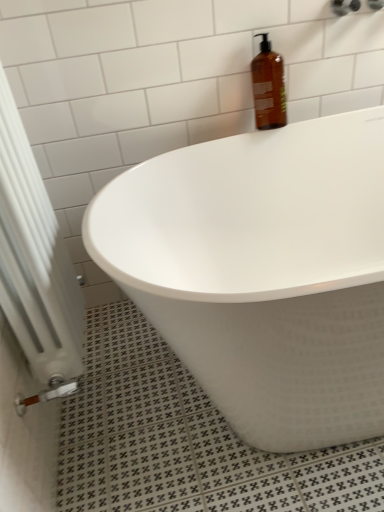
What is the approximate width of white glossy bathtub at upper center?

white glossy bathtub at upper center is 28.47 inches in width.

You are a GUI agent. You are given a task and a screenshot of the screen. Output one action in this format:
    pyautogui.click(x=<x>, y=<y>)
    Task: Click on the white glossy bathtub at upper center
    
    Given the screenshot: What is the action you would take?
    pyautogui.click(x=263, y=273)

The height and width of the screenshot is (512, 384). In order to click on radiator that appears on the left of brown glass bottle at upper center in this screenshot , I will do `click(35, 259)`.

Is brown glass bottle at upper center at the right side of white metallic radiator at lower left?

Correct, you'll find brown glass bottle at upper center to the right of white metallic radiator at lower left.

Looking at this image, is brown glass bottle at upper center beside white metallic radiator at lower left?

No, brown glass bottle at upper center is not touching white metallic radiator at lower left.

Based on the photo, is brown glass bottle at upper center looking in the opposite direction of white metallic radiator at lower left?

brown glass bottle at upper center is not turned away from white metallic radiator at lower left.

From a real-world perspective, does white metallic radiator at lower left sit lower than brown glass bottle at upper center?

Yes, from a real-world perspective, white metallic radiator at lower left is beneath brown glass bottle at upper center.

Is white metallic radiator at lower left at the right side of brown glass bottle at upper center?

No, white metallic radiator at lower left is not to the right of brown glass bottle at upper center.

Is brown glass bottle at upper center at the back of white glossy bathtub at upper center?

No.

From the image's perspective, is white glossy bathtub at upper center located above or below brown glass bottle at upper center?

Based on their image positions, white glossy bathtub at upper center is located beneath brown glass bottle at upper center.

How many degrees apart are the facing directions of white glossy bathtub at upper center and brown glass bottle at upper center?

The angular difference between white glossy bathtub at upper center and brown glass bottle at upper center is 0.916 degrees.

The width and height of the screenshot is (384, 512). What are the coordinates of `bathtub located below the brown glass bottle at upper center (from the image's perspective)` in the screenshot? It's located at (263, 273).

Which is correct: white glossy bathtub at upper center is inside white metallic radiator at lower left, or outside of it?

white glossy bathtub at upper center is not enclosed by white metallic radiator at lower left.

In terms of width, does white glossy bathtub at upper center look wider or thinner when compared to white metallic radiator at lower left?

Clearly, white glossy bathtub at upper center has more width compared to white metallic radiator at lower left.

Locate an element on the screen. Image resolution: width=384 pixels, height=512 pixels. bathtub on the right side of white metallic radiator at lower left is located at coordinates (263, 273).

In the scene shown: Visually, is white glossy bathtub at upper center positioned to the left or to the right of white metallic radiator at lower left?

white glossy bathtub at upper center is positioned on white metallic radiator at lower left's right side.

From a real-world perspective, is brown glass bottle at upper center above or below white glossy bathtub at upper center?

brown glass bottle at upper center is above white glossy bathtub at upper center.

Is brown glass bottle at upper center smaller than white glossy bathtub at upper center?

Yes, brown glass bottle at upper center is smaller than white glossy bathtub at upper center.

Is brown glass bottle at upper center at the left side of white glossy bathtub at upper center?

Correct, you'll find brown glass bottle at upper center to the left of white glossy bathtub at upper center.

You are a GUI agent. You are given a task and a screenshot of the screen. Output one action in this format:
    pyautogui.click(x=<x>, y=<y>)
    Task: Click on the bathtub that is in front of the brown glass bottle at upper center
    
    Given the screenshot: What is the action you would take?
    pyautogui.click(x=263, y=273)

Could you tell me if white metallic radiator at lower left is facing white glossy bathtub at upper center?

Yes, white metallic radiator at lower left is aimed at white glossy bathtub at upper center.

Is point (2, 112) farther from camera compared to point (115, 192)?

No, (2, 112) is in front of (115, 192).

From the image's perspective, is white metallic radiator at lower left above or below white glossy bathtub at upper center?

white metallic radiator at lower left is situated higher than white glossy bathtub at upper center in the image.

From the picture: Considering their positions, is white metallic radiator at lower left located in front of or behind white glossy bathtub at upper center?

white metallic radiator at lower left is positioned closer to the viewer than white glossy bathtub at upper center.

Identify the location of radiator below the brown glass bottle at upper center (from a real-world perspective). This screenshot has width=384, height=512. (35, 259).

Locate an element on the screen. This screenshot has width=384, height=512. radiator below the brown glass bottle at upper center (from the image's perspective) is located at coordinates (35, 259).

Estimate the real-world distances between objects in this image. Which object is further from white metallic radiator at lower left, brown glass bottle at upper center or white glossy bathtub at upper center?

The object further to white metallic radiator at lower left is brown glass bottle at upper center.

From the image, which object appears to be nearer to brown glass bottle at upper center, white metallic radiator at lower left or white glossy bathtub at upper center?

The object closer to brown glass bottle at upper center is white glossy bathtub at upper center.

Looking at the image, which one is located closer to white glossy bathtub at upper center, white metallic radiator at lower left or brown glass bottle at upper center?

white metallic radiator at lower left is closer to white glossy bathtub at upper center.

Considering their positions, is white glossy bathtub at upper center positioned further to white metallic radiator at lower left than brown glass bottle at upper center?

Based on the image, brown glass bottle at upper center appears to be further to white metallic radiator at lower left.

When comparing their distances from brown glass bottle at upper center, does white glossy bathtub at upper center or white metallic radiator at lower left seem further?

Based on the image, white metallic radiator at lower left appears to be further to brown glass bottle at upper center.

From the picture: Which object lies nearer to the anchor point white glossy bathtub at upper center, brown glass bottle at upper center or white metallic radiator at lower left?

white metallic radiator at lower left is closer to white glossy bathtub at upper center.

You are a GUI agent. You are given a task and a screenshot of the screen. Output one action in this format:
    pyautogui.click(x=<x>, y=<y>)
    Task: Click on the bottle situated between white metallic radiator at lower left and white glossy bathtub at upper center from left to right
    
    Given the screenshot: What is the action you would take?
    pyautogui.click(x=268, y=87)